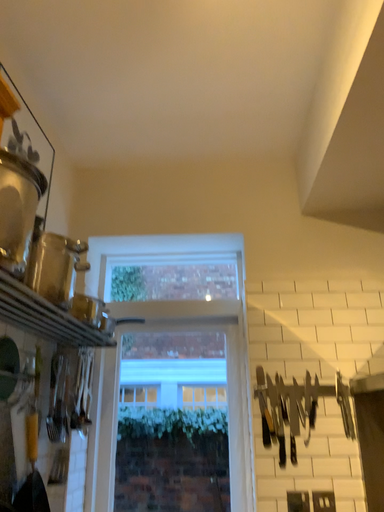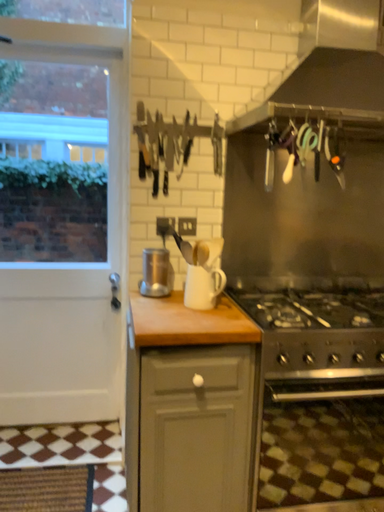
Question: Which way did the camera rotate in the video?

Choices:
 (A) rotated right
 (B) rotated left

Answer: (A)